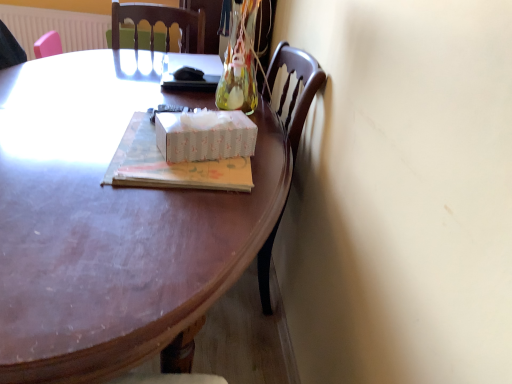
Question: Considering the positions of wooden desk at center and white paper tissue box at center in the image, is wooden desk at center bigger or smaller than white paper tissue box at center?

Choices:
 (A) small
 (B) big

Answer: (B)

Question: From a real-world perspective, is wooden desk at center above or below white paper tissue box at center?

Choices:
 (A) above
 (B) below

Answer: (B)

Question: Which object is positioned farthest from the matte cardboard book at center?

Choices:
 (A) white plastic radiator at upper left
 (B) white paper tissue box at center
 (C) wooden desk at center

Answer: (A)

Question: Which of these objects is positioned closest to the white paper tissue box at center?

Choices:
 (A) matte cardboard book at center
 (B) wooden desk at center
 (C) white plastic radiator at upper left

Answer: (A)